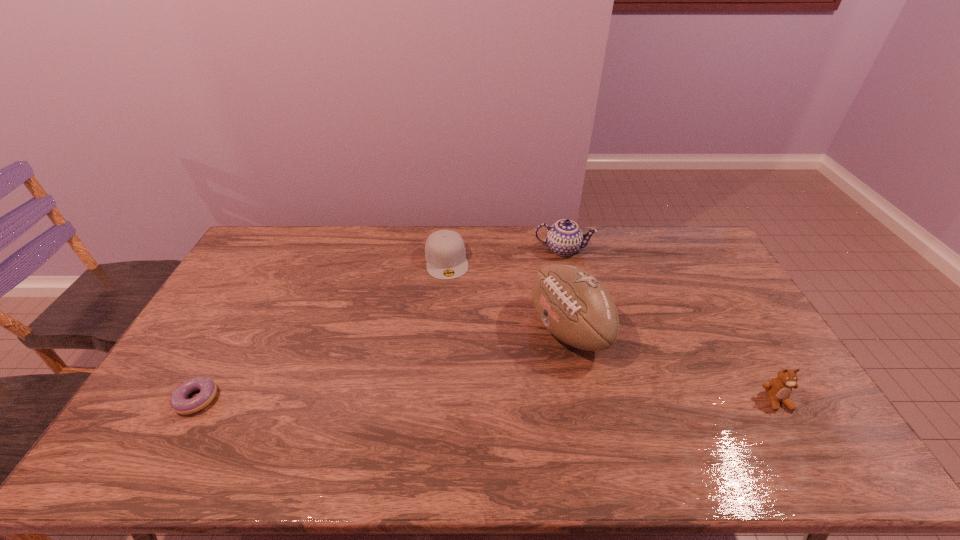
In the image, there is a desktop. At what (x,y) coordinates should I click in order to perform the action: click on vacant space at the far right corner. Please return your answer as a coordinate pair (x, y). The image size is (960, 540). Looking at the image, I should click on (680, 231).

Locate an element on the screen. blank space at the near right corner is located at coordinates (764, 410).

Image resolution: width=960 pixels, height=540 pixels. What are the coordinates of `vacant point located between the leftmost object and the fourth tallest object` in the screenshot? It's located at (322, 329).

Identify the location of free space that is in between the cap and the third farthest object. This screenshot has width=960, height=540. (508, 295).

Where is `unoccupied area between the leftmost object and the fourth shortest object`? The height and width of the screenshot is (540, 960). unoccupied area between the leftmost object and the fourth shortest object is located at coordinates (380, 324).

This screenshot has height=540, width=960. Identify the location of unoccupied area between the chinaware and the second shortest object. (505, 255).

Identify the location of free space between the football (American) and the leftmost object. This screenshot has height=540, width=960. (383, 364).

Find the location of a particular element. The image size is (960, 540). vacant point located between the chinaware and the doughnut is located at coordinates (380, 324).

Where is `vacant area between the rightmost object and the fourth shortest object`? The width and height of the screenshot is (960, 540). vacant area between the rightmost object and the fourth shortest object is located at coordinates (670, 325).

Identify which object is the third closest to the shortest object. Please provide its 2D coordinates. Your answer should be formatted as a tuple, i.e. [(x, y)], where the tuple contains the x and y coordinates of a point satisfying the conditions above.

[(564, 237)]